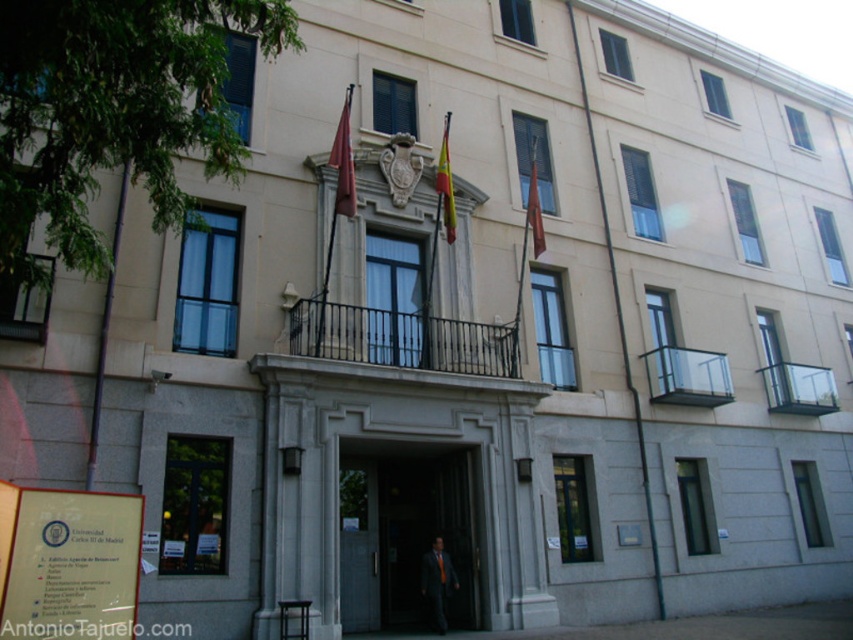
You are a delivery person trying to enter the building through the entrance. You notice the smooth gray door at center and the yellow fabric flag at center. Which object is wider?

The smooth gray door at center is wider than the yellow fabric flag at center.

You are a maintenance worker who needs to reach both the smooth gray door at center and the yellow fabric flag at center with a ladder. The ladder you have is 15 feet long. Can you safely reach both objects with this ladder?

The smooth gray door at center and yellow fabric flag at center are 17.08 feet apart. Since the ladder is only 15 feet long, it is not long enough to safely reach both objects as the distance between them exceeds the ladder length.